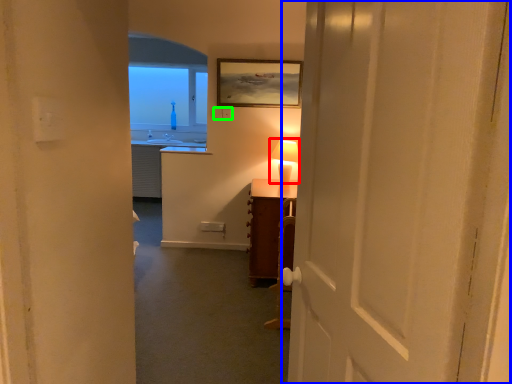
Question: Which is farther away from table lamp (highlighted by a red box)? door (highlighted by a blue box) or electric outlet (highlighted by a green box)?

Choices:
 (A) door
 (B) electric outlet

Answer: (A)